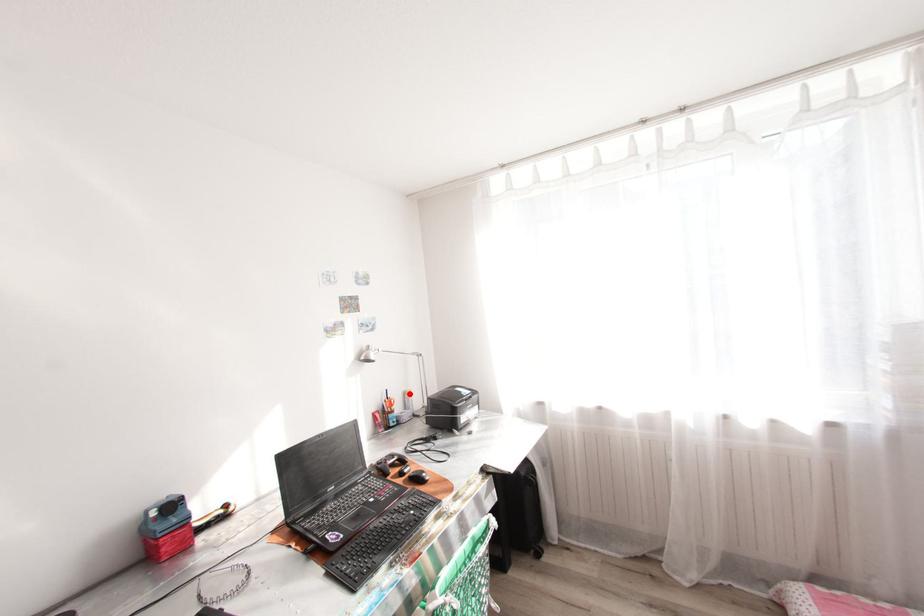
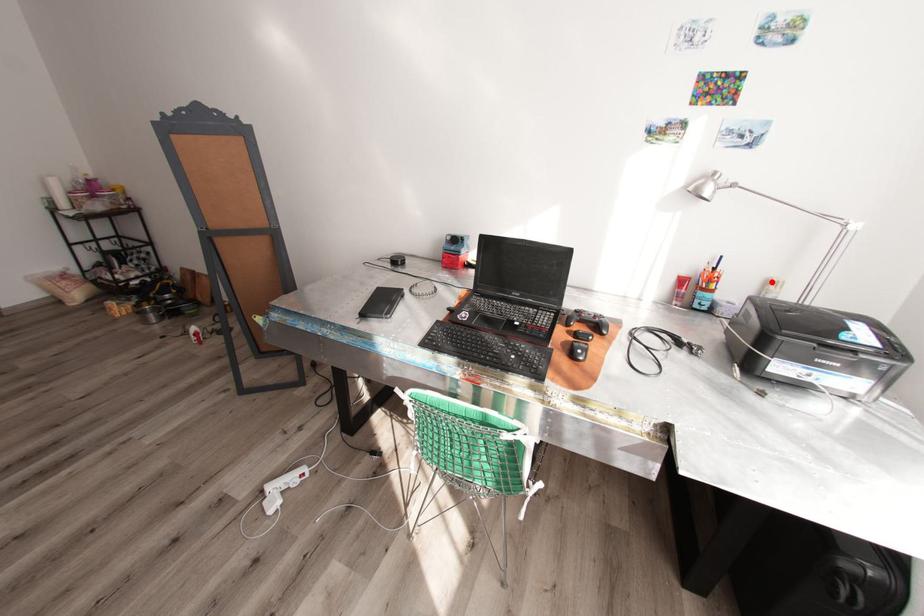
I am providing you with two images of the same scene from different viewpoints. A red point is marked on the first image and another point is marked on the second image. Is the marked point in image1 the same physical position as the marked point in image2?

Yes